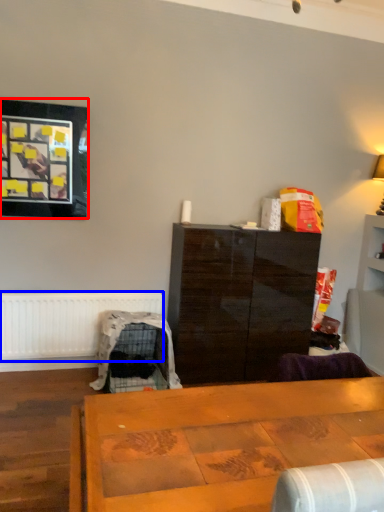
Question: Which object is further to the camera taking this photo, picture frame (highlighted by a red box) or radiator (highlighted by a blue box)?

Choices:
 (A) picture frame
 (B) radiator

Answer: (B)